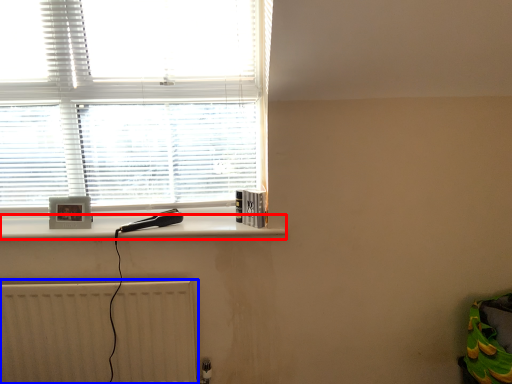
Question: Which object appears farthest to the camera in this image, ledge (highlighted by a red box) or radiator (highlighted by a blue box)?

Choices:
 (A) ledge
 (B) radiator

Answer: (A)